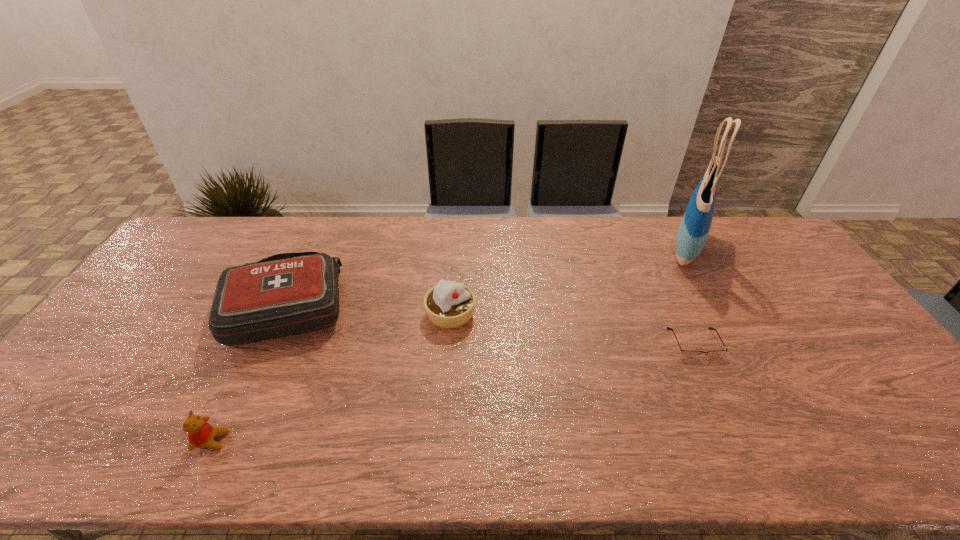
This screenshot has height=540, width=960. What are the coordinates of `tote bag` in the screenshot? It's located at (694, 228).

At what (x,y) coordinates should I click in order to perform the action: click on the first-aid kit. Please return your answer as a coordinate pair (x, y). Image resolution: width=960 pixels, height=540 pixels. Looking at the image, I should click on (290, 293).

Identify the location of whipped cream. This screenshot has height=540, width=960. (448, 304).

Locate an element on the screen. This screenshot has height=540, width=960. teddy bear is located at coordinates (201, 434).

This screenshot has height=540, width=960. In order to click on spectacles in this screenshot , I will do tap(685, 353).

You are a GUI agent. You are given a task and a screenshot of the screen. Output one action in this format:
    pyautogui.click(x=<x>, y=<y>)
    Task: Click on the free spot located on the front of the tallest object
    Image resolution: width=960 pixels, height=540 pixels.
    Given the screenshot: What is the action you would take?
    pyautogui.click(x=714, y=297)

This screenshot has height=540, width=960. Identify the location of blank space located on the back of the first-aid kit. (310, 254).

Where is `blank space located on the back of the third object from left to right`? blank space located on the back of the third object from left to right is located at coordinates (454, 261).

The width and height of the screenshot is (960, 540). I want to click on vacant space situated 0.120m on the front-facing side of the nearest object, so 279,441.

I want to click on blank space located 0.210m on the front-facing side of the shortest object, so click(736, 433).